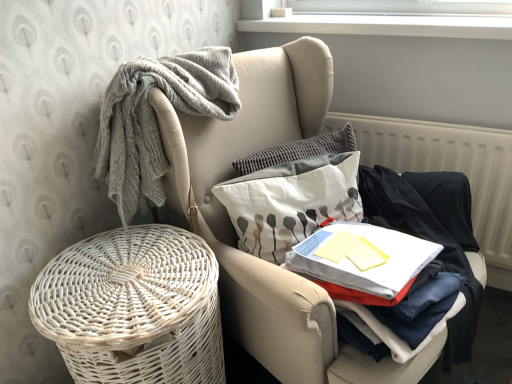
Question: Does white textured radiator at right turn towards white fabric pillow with gray floral pattern at center?

Choices:
 (A) yes
 (B) no

Answer: (A)

Question: From the image's perspective, is white textured radiator at right above white fabric pillow with gray floral pattern at center?

Choices:
 (A) no
 (B) yes

Answer: (B)

Question: Is white textured radiator at right taller than white fabric pillow with gray floral pattern at center?

Choices:
 (A) no
 (B) yes

Answer: (B)

Question: Would you say white textured radiator at right is outside white fabric pillow with gray floral pattern at center?

Choices:
 (A) yes
 (B) no

Answer: (A)

Question: Does white textured radiator at right have a lesser width compared to white fabric pillow with gray floral pattern at center?

Choices:
 (A) yes
 (B) no

Answer: (A)

Question: From the image's perspective, is white textured radiator at right below white fabric pillow with gray floral pattern at center?

Choices:
 (A) yes
 (B) no

Answer: (B)

Question: Does white textured radiator at right lie in front of white wicker basket at lower left?

Choices:
 (A) yes
 (B) no

Answer: (B)

Question: Can you confirm if white textured radiator at right is shorter than white wicker basket at lower left?

Choices:
 (A) no
 (B) yes

Answer: (A)

Question: From the image's perspective, is white textured radiator at right on white wicker basket at lower left?

Choices:
 (A) no
 (B) yes

Answer: (B)

Question: Is white wicker basket at lower left a part of white textured radiator at right?

Choices:
 (A) yes
 (B) no

Answer: (B)

Question: From a real-world perspective, is white textured radiator at right located beneath white wicker basket at lower left?

Choices:
 (A) yes
 (B) no

Answer: (B)

Question: Does white textured radiator at right have a larger size compared to white wicker basket at lower left?

Choices:
 (A) yes
 (B) no

Answer: (B)

Question: Does white fabric pillow with gray floral pattern at center touch white wicker basket at lower left?

Choices:
 (A) no
 (B) yes

Answer: (A)